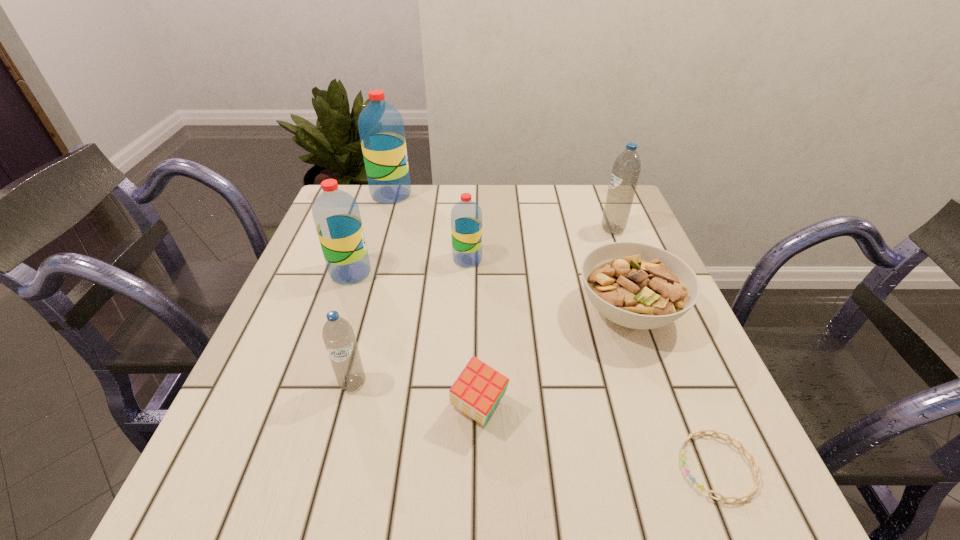
The image size is (960, 540). In the image, there is a desktop. In order to click on vacant space at the far edge in this screenshot , I will do `click(410, 212)`.

Locate an element on the screen. The image size is (960, 540). vacant space at the near edge is located at coordinates (351, 464).

Where is `free region at the left edge`? free region at the left edge is located at coordinates (296, 372).

Locate an element on the screen. This screenshot has width=960, height=540. free space at the far left corner is located at coordinates (363, 201).

Image resolution: width=960 pixels, height=540 pixels. In the image, there is a desktop. Identify the location of blank space at the near left corner. (212, 488).

Where is `blank area at the far right corner`? The height and width of the screenshot is (540, 960). blank area at the far right corner is located at coordinates (601, 221).

Where is `free space between the nearer blue water bottle and the stew`? free space between the nearer blue water bottle and the stew is located at coordinates (491, 347).

Find the location of `vacant space that's between the gray stew and the bracelet`. vacant space that's between the gray stew and the bracelet is located at coordinates (673, 389).

At what (x,y) coordinates should I click in order to perform the action: click on vacant region between the second water bottle from right to left and the gray stew. Please return your answer as a coordinate pair (x, y). Image resolution: width=960 pixels, height=540 pixels. Looking at the image, I should click on (548, 285).

Identify the location of vacant space in between the red cube and the second farthest water bottle. This screenshot has width=960, height=540. (545, 319).